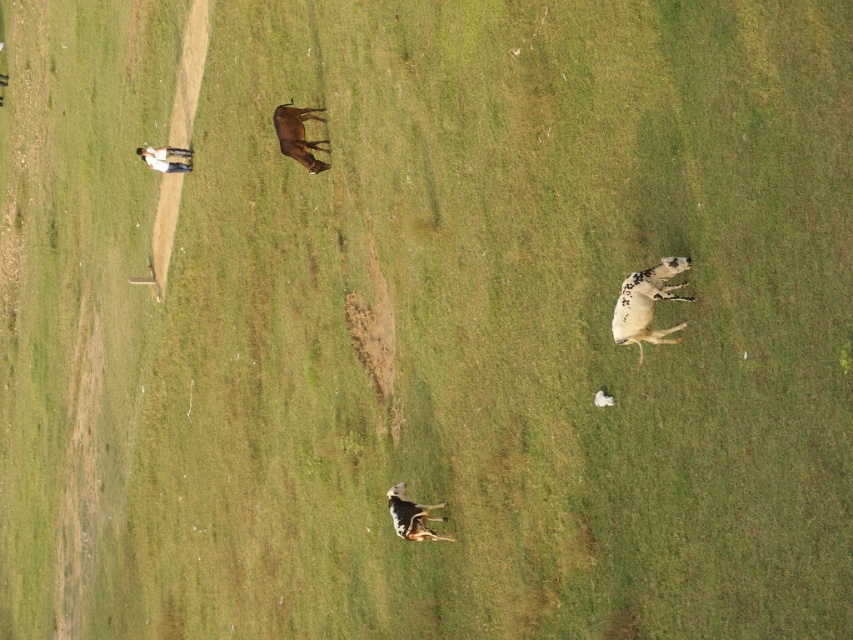
Can you confirm if white speckled fur at lower right is bigger than white glossy cow at upper left?

No, white speckled fur at lower right is not bigger than white glossy cow at upper left.

Who is more distant from viewer, (639, 284) or (180, 148)?

The point (180, 148) is behind.

Locate an element on the screen. This screenshot has height=640, width=853. white speckled fur at lower right is located at coordinates click(646, 304).

Can you confirm if white speckled fur at lower right is thinner than brown glossy cow at upper center?

Indeed, white speckled fur at lower right has a lesser width compared to brown glossy cow at upper center.

Which is more to the left, white speckled fur at lower right or brown glossy cow at upper center?

brown glossy cow at upper center

Is point (648, 307) positioned after point (292, 134)?

No, (648, 307) is in front of (292, 134).

This screenshot has width=853, height=640. I want to click on white speckled fur at lower right, so click(x=646, y=304).

Consider the image. Measure the distance between point (286, 113) and camera.

They are 113.32 feet apart.

At what (x,y) coordinates should I click in order to perform the action: click on brown glossy cow at upper center. Please return your answer as a coordinate pair (x, y). This screenshot has height=640, width=853. Looking at the image, I should click on (299, 134).

You are a GUI agent. You are given a task and a screenshot of the screen. Output one action in this format:
    pyautogui.click(x=<x>, y=<y>)
    Task: Click on the brown glossy cow at upper center
    This screenshot has width=853, height=640.
    Given the screenshot: What is the action you would take?
    pyautogui.click(x=299, y=134)